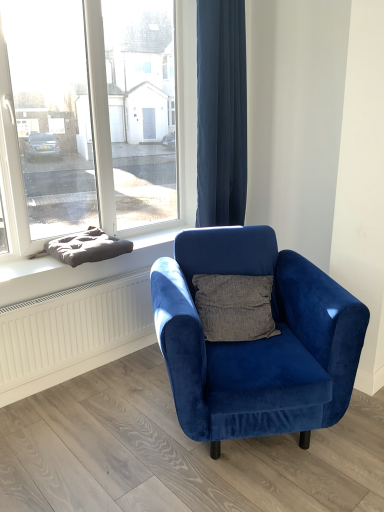
What do you see at coordinates (221, 113) in the screenshot? I see `dark blue fabric curtain at upper right` at bounding box center [221, 113].

In order to click on transparent glass window at upper left in this screenshot , I will do `click(96, 117)`.

What are the coordinates of `dark gray cushion at left` in the screenshot? It's located at (24, 266).

The width and height of the screenshot is (384, 512). What do you see at coordinates (24, 266) in the screenshot?
I see `dark gray cushion at left` at bounding box center [24, 266].

The image size is (384, 512). Describe the element at coordinates (256, 341) in the screenshot. I see `velvet blue armchair at center` at that location.

The height and width of the screenshot is (512, 384). Find the location of `white textured radiator at lower left`. white textured radiator at lower left is located at coordinates (72, 332).

Does velvet blue armchair at center touch white textured radiator at lower left?

No, velvet blue armchair at center is not with white textured radiator at lower left.

Looking at this image, between velvet blue armchair at center and white textured radiator at lower left, which one is positioned in front?

velvet blue armchair at center.

Does velvet blue armchair at center have a lesser height compared to white textured radiator at lower left?

Incorrect, the height of velvet blue armchair at center does not fall short of that of white textured radiator at lower left.

Does velvet blue armchair at center have a larger size compared to white textured radiator at lower left?

Indeed, velvet blue armchair at center has a larger size compared to white textured radiator at lower left.

Which object is further away from the camera, dark gray cushion at left or white textured radiator at lower left?

white textured radiator at lower left.

Can you tell me how much dark gray cushion at left and white textured radiator at lower left differ in facing direction?

The angular difference between dark gray cushion at left and white textured radiator at lower left is 0.597 degrees.

Which point is more distant from viewer, (3, 259) or (130, 282)?

Positioned behind is point (130, 282).

Can you confirm if dark gray cushion at left is shorter than white textured radiator at lower left?

Yes, dark gray cushion at left is shorter than white textured radiator at lower left.

Looking at this image, between dark blue fabric curtain at upper right and dark gray cushion at left, which one has less height?

Standing shorter between the two is dark gray cushion at left.

Does dark blue fabric curtain at upper right turn towards dark gray cushion at left?

No.

Considering the relative positions of dark blue fabric curtain at upper right and dark gray cushion at left in the image provided, is dark blue fabric curtain at upper right in front of dark gray cushion at left?

No, dark blue fabric curtain at upper right is further to the viewer.

Looking at this image, would you say dark blue fabric curtain at upper right is to the left or to the right of dark gray cushion at left in the picture?

dark blue fabric curtain at upper right is positioned on dark gray cushion at left's right side.

From a real-world perspective, is white textured radiator at lower left physically located above or below dark blue fabric curtain at upper right?

white textured radiator at lower left is situated lower than dark blue fabric curtain at upper right in the real world.

Who is bigger, white textured radiator at lower left or dark blue fabric curtain at upper right?

dark blue fabric curtain at upper right is bigger.

Which of these two, transparent glass window at upper left or white textured radiator at lower left, is thinner?

With smaller width is white textured radiator at lower left.

From the image's perspective, who appears lower, transparent glass window at upper left or white textured radiator at lower left?

From the image's view, white textured radiator at lower left is below.

Where is `window located in front of the white textured radiator at lower left`? window located in front of the white textured radiator at lower left is located at coordinates (96, 117).

From the image's perspective, between white textured radiator at lower left and transparent glass window at upper left, which one is located above?

From the image's view, transparent glass window at upper left is above.

Find the location of a particular element. The image size is (384, 512). window above the white textured radiator at lower left (from a real-world perspective) is located at coordinates (96, 117).

Is point (102, 325) farther from camera compared to point (28, 64)?

No, (102, 325) is in front of (28, 64).

From the image's perspective, between dark gray cushion at left and transparent glass window at upper left, who is located below?

From the image's view, dark gray cushion at left is below.

Would you say dark gray cushion at left is to the left or to the right of transparent glass window at upper left in the picture?

In the image, dark gray cushion at left appears on the right side of transparent glass window at upper left.

Does dark gray cushion at left have a larger size compared to transparent glass window at upper left?

Actually, dark gray cushion at left might be smaller than transparent glass window at upper left.

From a real-world perspective, is dark gray cushion at left physically above transparent glass window at upper left?

No, from a real-world perspective, dark gray cushion at left is not over transparent glass window at upper left

Identify the location of radiator behind the velvet blue armchair at center. (72, 332).

Identify the location of window sill positioned vertically above the white textured radiator at lower left (from a real-world perspective). The image size is (384, 512). (24, 266).

Looking at the image, which one is located closer to transparent glass window at upper left, velvet blue armchair at center or dark gray cushion at left?

dark gray cushion at left is closer to transparent glass window at upper left.

Looking at the image, which one is located closer to transparent glass window at upper left, dark gray cushion at left or velvet blue armchair at center?

dark gray cushion at left is closer to transparent glass window at upper left.

Which object lies further to the anchor point white textured radiator at lower left, velvet blue armchair at center or dark gray cushion at left?

Based on the image, velvet blue armchair at center appears to be further to white textured radiator at lower left.

When comparing their distances from dark blue fabric curtain at upper right, does white textured radiator at lower left or dark gray cushion at left seem closer?

Based on the image, white textured radiator at lower left appears to be nearer to dark blue fabric curtain at upper right.

Based on their spatial positions, is velvet blue armchair at center or dark gray cushion at left closer to dark blue fabric curtain at upper right?

velvet blue armchair at center is closer to dark blue fabric curtain at upper right.

Considering their positions, is dark blue fabric curtain at upper right positioned further to transparent glass window at upper left than dark gray cushion at left?

Among the two, dark gray cushion at left is located further to transparent glass window at upper left.

When comparing their distances from velvet blue armchair at center, does dark blue fabric curtain at upper right or transparent glass window at upper left seem further?

transparent glass window at upper left is further to velvet blue armchair at center.

Which object lies further to the anchor point dark blue fabric curtain at upper right, velvet blue armchair at center or transparent glass window at upper left?

velvet blue armchair at center.

At what (x,y) coordinates should I click in order to perform the action: click on window sill between transparent glass window at upper left and velvet blue armchair at center in the vertical direction. Please return your answer as a coordinate pair (x, y). This screenshot has height=512, width=384. Looking at the image, I should click on (24, 266).

Locate an element on the screen. This screenshot has height=512, width=384. window sill between dark blue fabric curtain at upper right and white textured radiator at lower left from top to bottom is located at coordinates (24, 266).

You are a GUI agent. You are given a task and a screenshot of the screen. Output one action in this format:
    pyautogui.click(x=<x>, y=<y>)
    Task: Click on the window sill between dark blue fabric curtain at upper right and velvet blue armchair at center in the vertical direction
    
    Given the screenshot: What is the action you would take?
    pyautogui.click(x=24, y=266)

What are the coordinates of `window between dark blue fabric curtain at upper right and dark gray cushion at left in the vertical direction` in the screenshot? It's located at (96, 117).